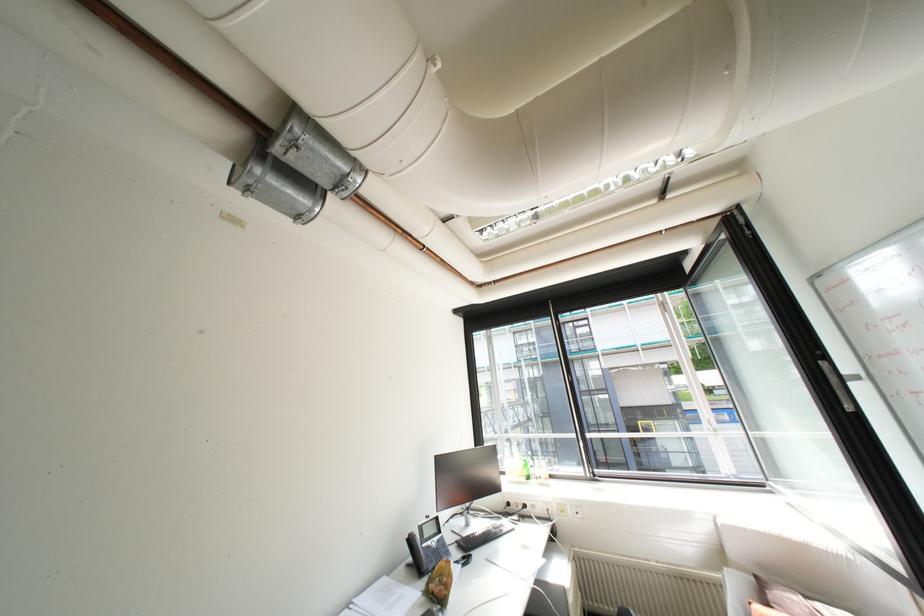
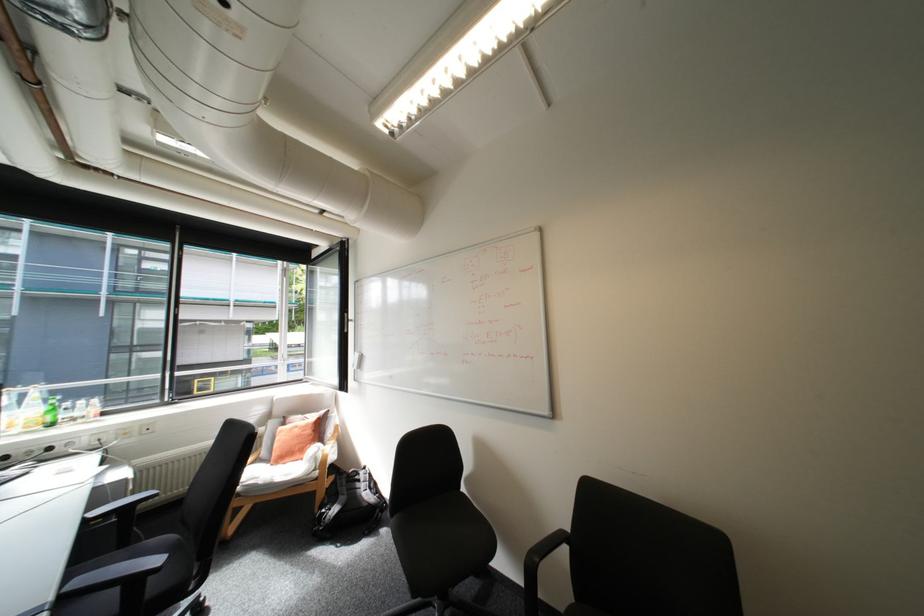
Locate, in the second image, the point that corresponds to (x=528, y=477) in the first image.

(38, 427)